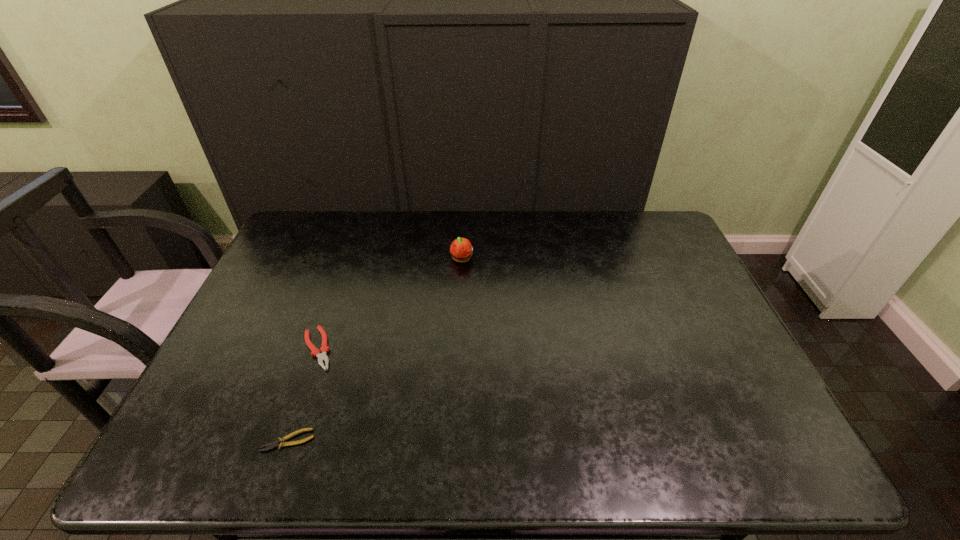
Where is `the farthest object`? the farthest object is located at coordinates (461, 249).

Locate an element on the screen. The image size is (960, 540). apple is located at coordinates (461, 249).

Where is `the taller pliers`? The width and height of the screenshot is (960, 540). the taller pliers is located at coordinates (315, 352).

Find the location of `the farther pliers`. the farther pliers is located at coordinates (315, 352).

Identify the location of the shortest object. The height and width of the screenshot is (540, 960). (275, 444).

This screenshot has width=960, height=540. Find the location of `the shorter pliers`. the shorter pliers is located at coordinates (275, 444).

The height and width of the screenshot is (540, 960). I want to click on free space located 0.060m on the front of the rightmost object, so coord(461,280).

At what (x,y) coordinates should I click in order to perform the action: click on vacant area located 0.110m on the back of the second tallest object. Please return your answer as a coordinate pair (x, y). The width and height of the screenshot is (960, 540). Looking at the image, I should click on (334, 300).

The height and width of the screenshot is (540, 960). Identify the location of free location located 0.210m on the left of the nearest object. pyautogui.click(x=170, y=441).

Image resolution: width=960 pixels, height=540 pixels. I want to click on object positioned at the near edge, so click(275, 444).